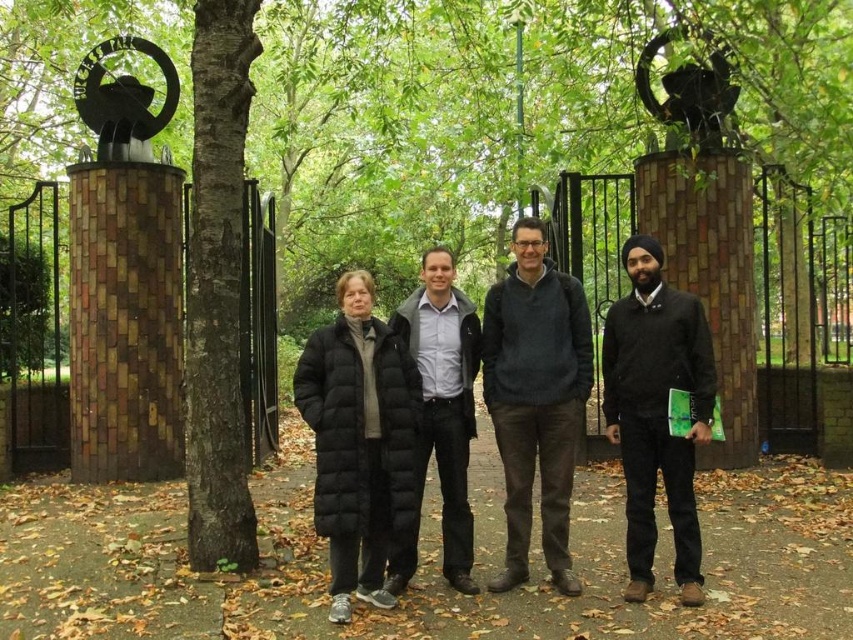
You are a photographer standing at the entrance of the park and want to take a photo of the group. The camera you are using has a minimum focus distance of 15 feet. Will the black quilted coat at center be in focus?

The black quilted coat at center is 17.21 feet away from the viewer. Since the camera can focus as close as 15 feet, the coat is within the focus range and will be in focus.

You are a photographer trying to capture the group photo of the woman in black puffer jacket and the man in gray jacket, and the black quilted coat at center. Where should you position the camera to ensure all three are in the frame?

Position the camera so that it is centered around the black quilted coat at center, which is located at coordinates approximately 0.622 on the x and 0.628 on the y axis. This central position will help ensure the woman in black puffer jacket and the man in gray jacket are also within the frame.

You are a fashion designer observing the park scene. You notice the black quilted coat at center and the dark brown bark at center. Which item would you say is larger in size?

The black quilted coat at center is bigger than dark brown bark at center.